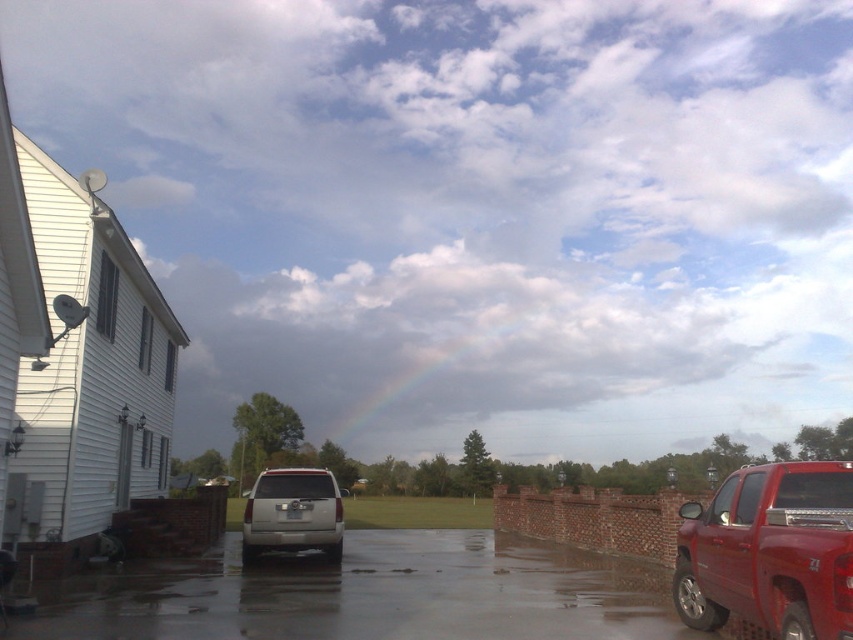
Image resolution: width=853 pixels, height=640 pixels. Describe the element at coordinates (770, 552) in the screenshot. I see `glossy red truck at right` at that location.

From the picture: Is glossy red truck at right behind satin silver suv at center?

That is False.

Locate an element on the screen. This screenshot has width=853, height=640. glossy red truck at right is located at coordinates (770, 552).

At what (x,y) coordinates should I click in order to perform the action: click on glossy red truck at right. Please return your answer as a coordinate pair (x, y). Looking at the image, I should click on (770, 552).

Is point (643, 588) positioned behind point (799, 582)?

Yes, it is behind point (799, 582).

From the picture: Does glossy asphalt driveway at center have a smaller size compared to glossy red truck at right?

Actually, glossy asphalt driveway at center might be larger than glossy red truck at right.

Is point (473, 589) closer to viewer compared to point (849, 470)?

No, (473, 589) is further to viewer.

This screenshot has width=853, height=640. What are the coordinates of `glossy asphalt driveway at center` in the screenshot? It's located at (367, 595).

Does glossy asphalt driveway at center appear over satin silver suv at center?

Indeed, glossy asphalt driveway at center is positioned over satin silver suv at center.

Does point (653, 627) lie in front of point (309, 541)?

Yes, point (653, 627) is in front of point (309, 541).

At what (x,y) coordinates should I click in order to perform the action: click on glossy asphalt driveway at center. Please return your answer as a coordinate pair (x, y). Image resolution: width=853 pixels, height=640 pixels. Looking at the image, I should click on pos(367,595).